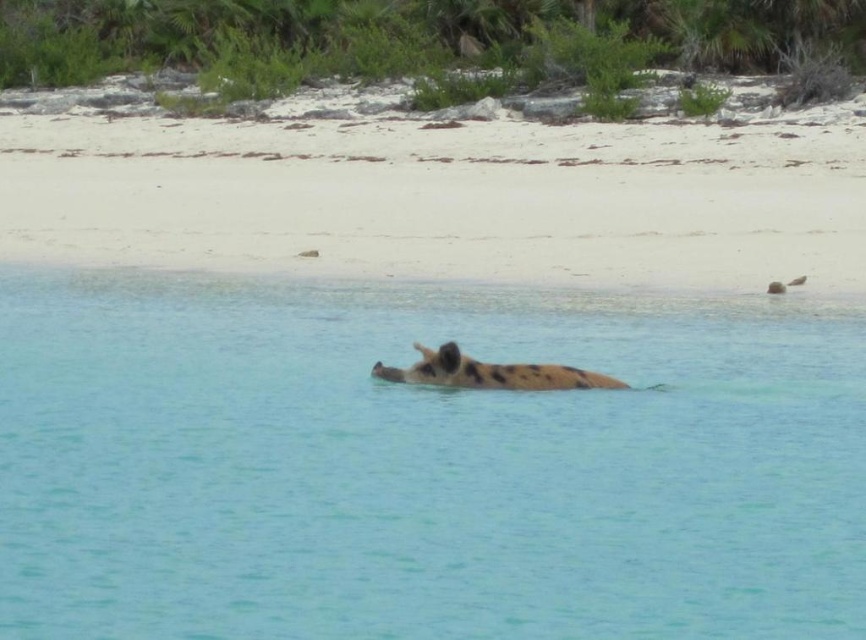
Can you confirm if clear blue water at center is shorter than spotted fur animal at center?

No, clear blue water at center is not shorter than spotted fur animal at center.

Is point (154, 627) less distant than point (589, 385)?

Yes.

Where is `clear blue water at center`? This screenshot has height=640, width=866. clear blue water at center is located at coordinates (422, 464).

Is clear blue water at center to the left of white sand beach at center from the viewer's perspective?

Yes, clear blue water at center is to the left of white sand beach at center.

Does clear blue water at center appear under white sand beach at center?

Indeed, clear blue water at center is positioned under white sand beach at center.

I want to click on clear blue water at center, so tap(422, 464).

This screenshot has height=640, width=866. In order to click on clear blue water at center in this screenshot , I will do `click(422, 464)`.

Does white sand beach at center appear on the left side of spotted fur animal at center?

Incorrect, white sand beach at center is not on the left side of spotted fur animal at center.

Does white sand beach at center have a greater height compared to spotted fur animal at center?

Yes.

Which is behind, point (99, 202) or point (437, 362)?

The point (99, 202) is behind.

Image resolution: width=866 pixels, height=640 pixels. In order to click on white sand beach at center in this screenshot , I will do `click(446, 196)`.